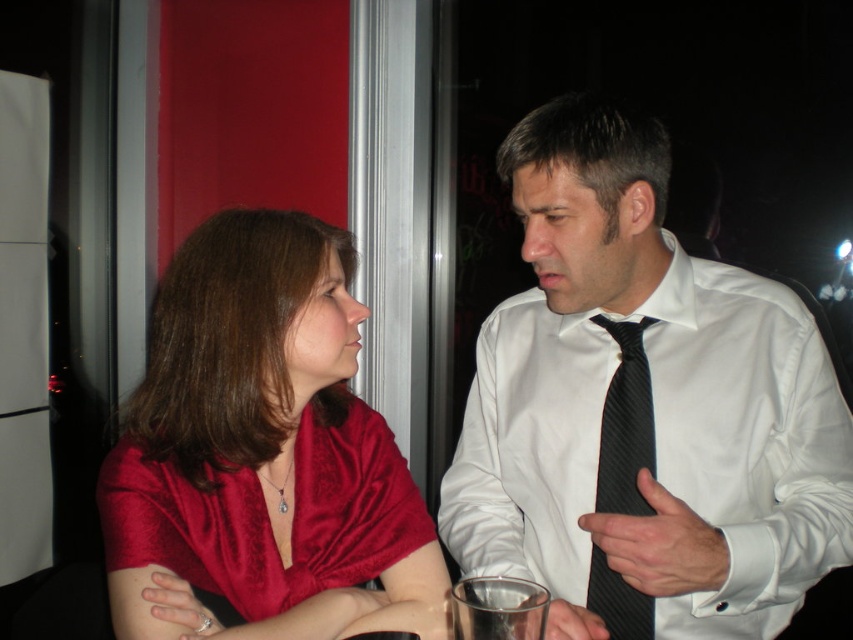
You are a photographer trying to capture a candid shot of both the satin red blouse at center and the black striped tie at right. Since you want to ensure both are visible in the frame, does the current arrangement allow you to see both objects without one blocking the other?

The satin red blouse at center is in front of the black striped tie at right, so the blouse will block part of the tie in the photo. Adjust your angle to avoid overlap.

You are standing in the social setting shown and want to place a small decorative item exactly at point [277,525]. If your hand is currently 1.0 meters away from that point, how much further do you need to extend your hand to reach the point?

The distance of point [277,525] from the viewer is 1.10 meters. Since your hand is currently 1.0 meters away, you need to extend it an additional 0.10 meters to reach the point.